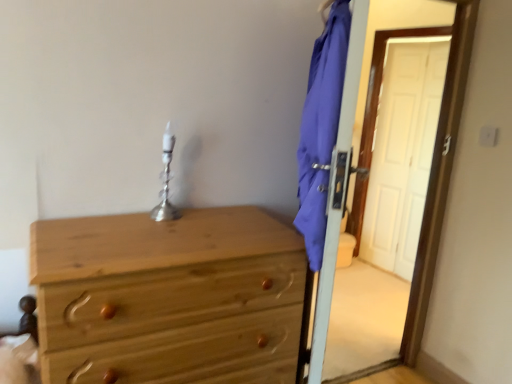
Locate an element on the screen. free point above natural wood chest of drawers at left (from a real-world perspective) is located at coordinates (158, 234).